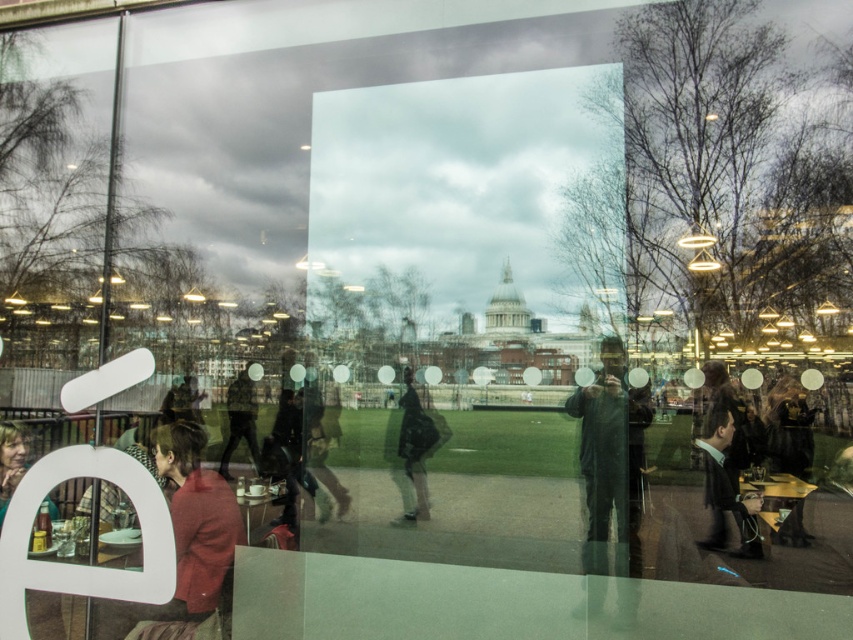
Question: Which object is positioned closest to the green fabric jacket at lower right?

Choices:
 (A) camouflage jacket at center
 (B) matte red coat at lower left

Answer: (B)

Question: Which point is farther to the camera?

Choices:
 (A) (741, 506)
 (B) (415, 474)
 (C) (602, 364)
 (D) (788, 560)

Answer: (C)

Question: Does dark gray jacket at center lie in front of green fabric jacket at lower right?

Choices:
 (A) yes
 (B) no

Answer: (A)

Question: Among these objects, which one is farthest from the camera?

Choices:
 (A) dark suit at right
 (B) matte red coat at lower left
 (C) camouflage jacket at center
 (D) green fabric jacket at lower right

Answer: (C)

Question: Can you confirm if dark suit at right is bigger than matte black jacket at lower left?

Choices:
 (A) yes
 (B) no

Answer: (B)

Question: Can you confirm if matte red coat at lower left is smaller than dark suit at right?

Choices:
 (A) no
 (B) yes

Answer: (A)